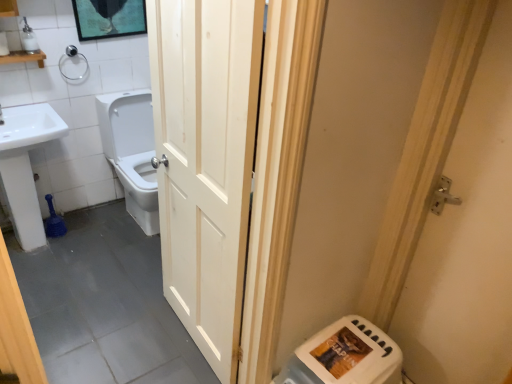
Question: Would you say white glossy toilet at center is inside or outside white plastic soap dispenser at upper left?

Choices:
 (A) outside
 (B) inside

Answer: (A)

Question: In terms of width, does white glossy toilet at center look wider or thinner when compared to white plastic soap dispenser at upper left?

Choices:
 (A) thin
 (B) wide

Answer: (B)

Question: Which object is the closest to the white glossy toilet at center?

Choices:
 (A) white wood door at center, the first door when ordered from left to right
 (B) white plastic soap dispenser at upper left
 (C) silver metallic door handle at right, which is the 1th door in right-to-left order
 (D) satin nickel towel bar at upper left
 (E) white plastic water heater at lower right

Answer: (D)

Question: Considering the real-world distances, which object is farthest from the silver metallic door handle at right, which is the 1th door in right-to-left order?

Choices:
 (A) satin nickel towel bar at upper left
 (B) white ceramic sink at left
 (C) white wood door at center, the first door when ordered from left to right
 (D) white plastic soap dispenser at upper left
 (E) white plastic water heater at lower right

Answer: (D)